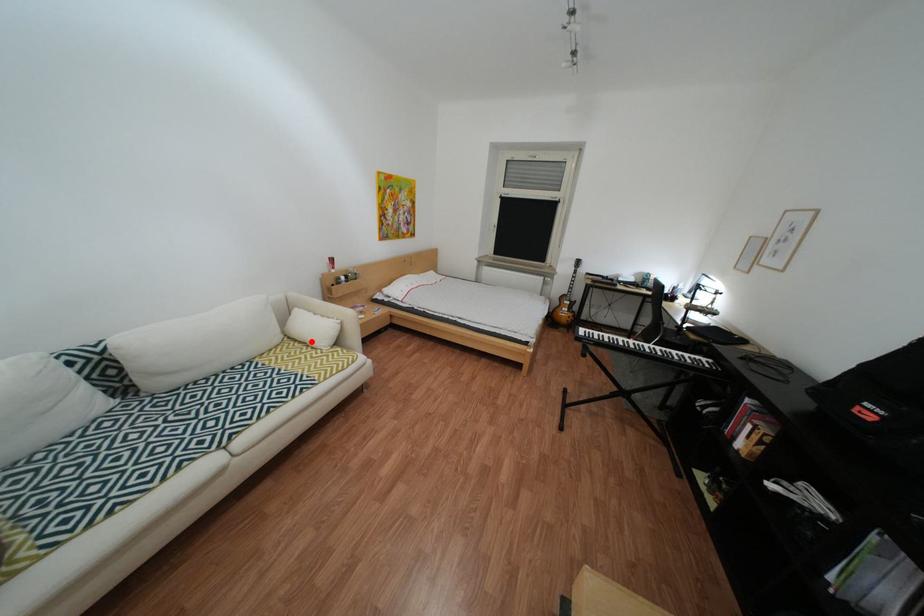
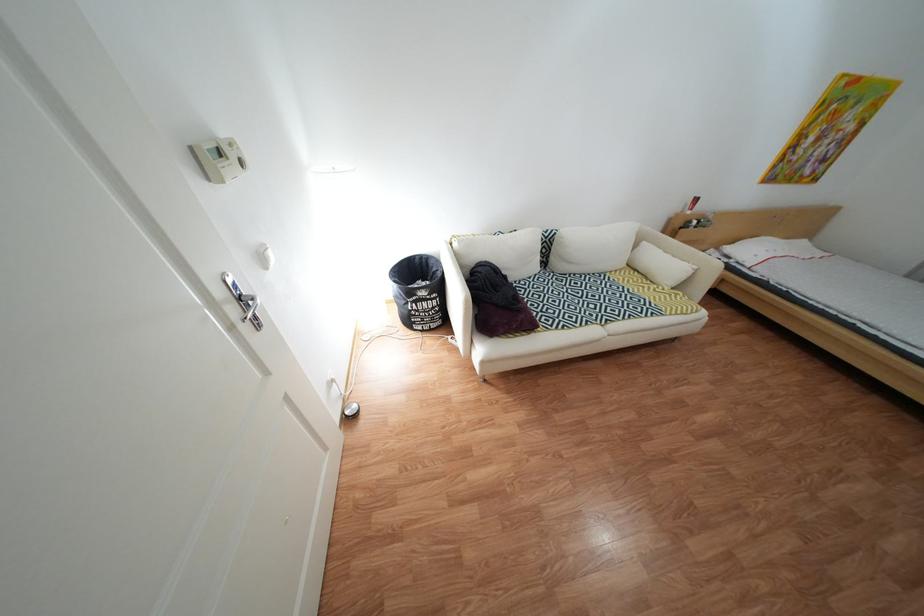
Question: A red point is marked in image1. In image2, is the corresponding 3D point closer to the camera or farther? Reply with the corresponding letter.

Choices:
 (A) The corresponding 3D point is closer.
 (B) The corresponding 3D point is farther.

Answer: (A)